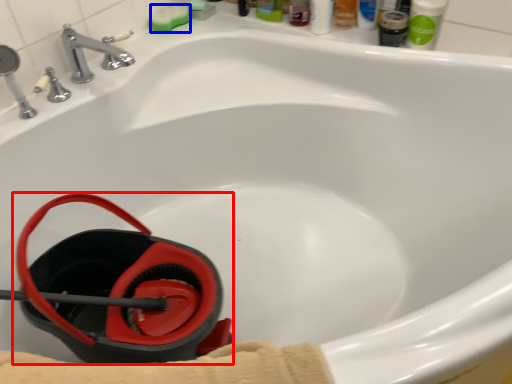
Question: Which object is closer to the camera taking this photo, job (highlighted by a red box) or soap (highlighted by a blue box)?

Choices:
 (A) job
 (B) soap

Answer: (A)